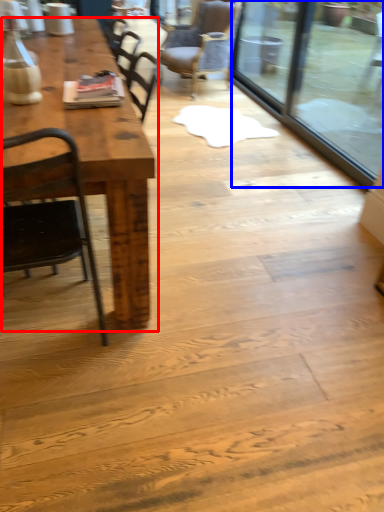
Question: Which object is closer to the camera taking this photo, table (highlighted by a red box) or glass door (highlighted by a blue box)?

Choices:
 (A) table
 (B) glass door

Answer: (A)